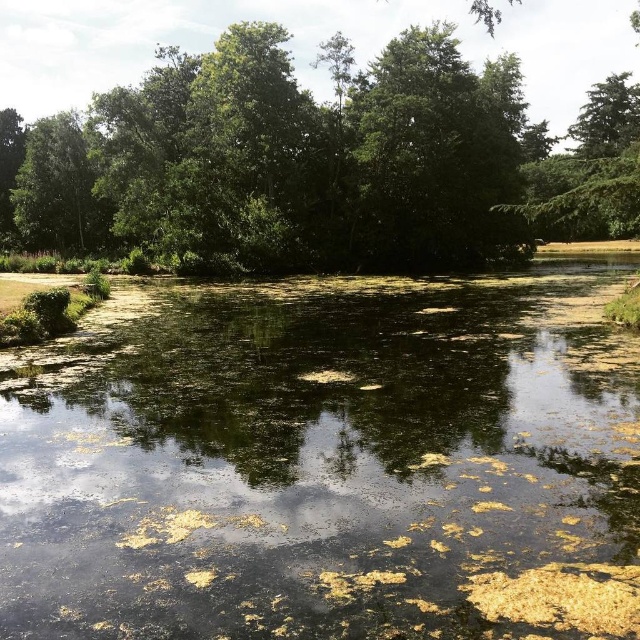
Question: Which is farther from the green leafy tree at center?

Choices:
 (A) green leafy tree at left
 (B) green algae-covered water at center

Answer: (B)

Question: Is green algae-covered water at center bigger than green leafy tree at left?

Choices:
 (A) no
 (B) yes

Answer: (A)

Question: Which object appears farthest from the camera in this image?

Choices:
 (A) green leafy tree at left
 (B) green algae-covered water at center
 (C) green leafy tree at center

Answer: (A)

Question: Estimate the real-world distances between objects in this image. Which object is farther from the green leafy tree at center?

Choices:
 (A) green algae-covered water at center
 (B) green leafy tree at left

Answer: (A)

Question: Where is green algae-covered water at center located in relation to green leafy tree at left in the image?

Choices:
 (A) below
 (B) above

Answer: (A)

Question: Is green algae-covered water at center positioned before green leafy tree at left?

Choices:
 (A) no
 (B) yes

Answer: (B)